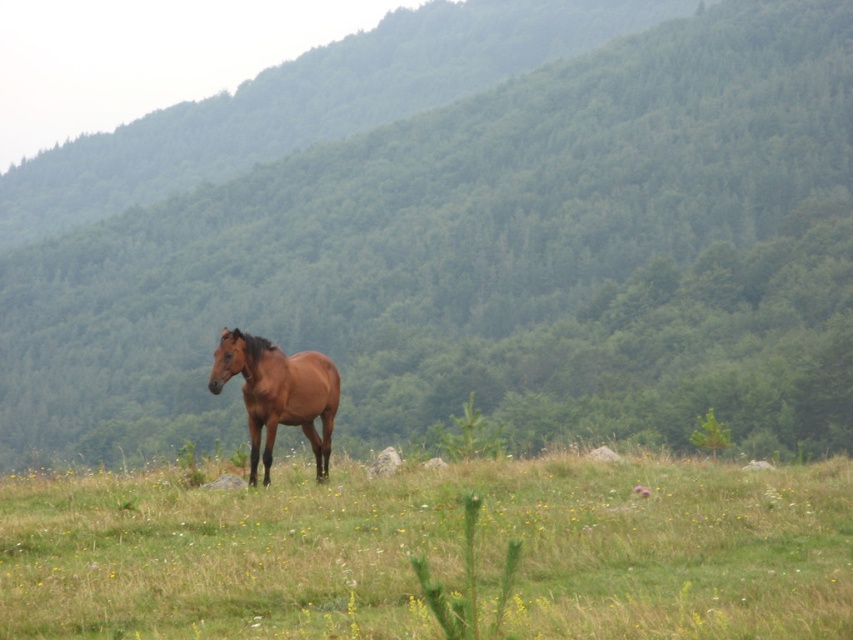
You are a hiker planning to cross the field in the image. You see the green forested mountain at center and the green grass at center. Which one has a wider area?

The green forested mountain at center has a wider area than the green grass at center.

What is the 2D coordinate of the green grass at center in the image?

The 2D coordinate of the green grass at center is at point (434, 552).

You are a photographer trying to capture the brown glossy horse at center. You want to ensure the horse stands out against the green grass at center. Based on the scene description, will the height difference between them help in making the horse more visible in your photo?

The green grass at center has a lesser height compared to the brown glossy horse at center, so the horse will naturally stand out more against the shorter grass, enhancing its visibility in the photo.